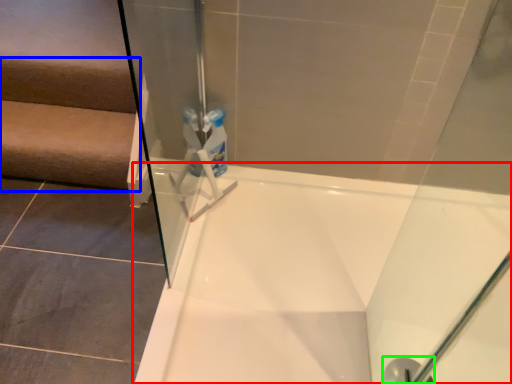
Question: Which object is positioned farthest from bathtub (highlighted by a red box)? Select from stairwell (highlighted by a blue box) and shower (highlighted by a green box).

Choices:
 (A) stairwell
 (B) shower

Answer: (A)